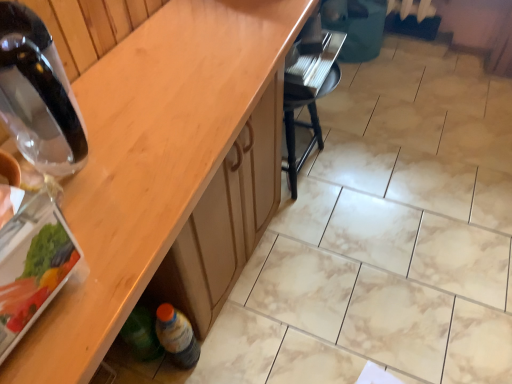
Find the location of a particular element. The image size is (512, 384). free spot behind transparent glass bottle at left, which is the 2th bottle from bottom to top is located at coordinates (117, 94).